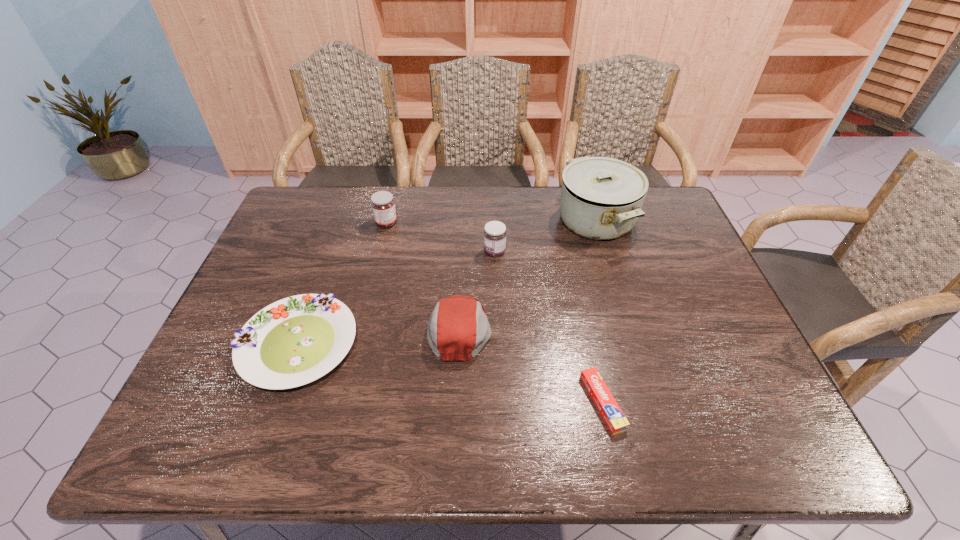
At what (x,y) coordinates should I click in order to perform the action: click on vacant space located on the front label of the nearer jam. Please return your answer as a coordinate pair (x, y). The height and width of the screenshot is (540, 960). Looking at the image, I should click on (399, 252).

The width and height of the screenshot is (960, 540). Identify the location of vacant space located 0.160m on the front label of the nearer jam. (430, 252).

Find the location of a particular element. vacant area situated 0.170m on the right of the fifth tallest object is located at coordinates (426, 345).

Identify the location of blank space located on the left of the toothpaste. (530, 402).

The image size is (960, 540). I want to click on saucepan that is at the far edge, so pyautogui.click(x=601, y=198).

Where is `jam that is at the far edge`? The image size is (960, 540). jam that is at the far edge is located at coordinates coord(383,205).

Find the location of a particular element. The image size is (960, 540). object situated at the near edge is located at coordinates (613, 416).

Locate an element on the screen. object that is at the left edge is located at coordinates (294, 341).

Where is `object that is positioned at the right edge`? object that is positioned at the right edge is located at coordinates (601, 198).

Identify the location of object situated at the far right corner. Image resolution: width=960 pixels, height=540 pixels. (601, 198).